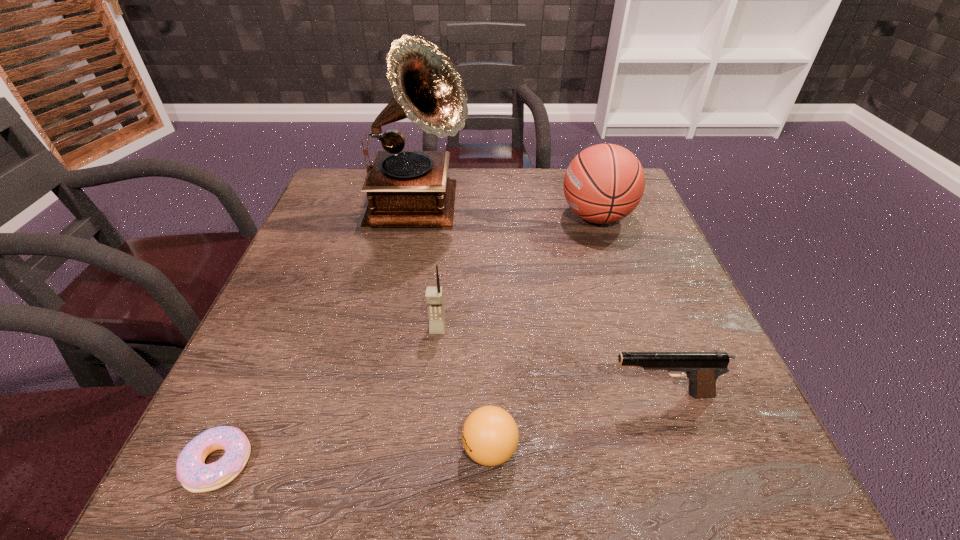
What are the coordinates of `empty space between the pistol and the cellular telephone` in the screenshot? It's located at (549, 362).

Where is `free spot between the doughnut and the basketball`? The height and width of the screenshot is (540, 960). free spot between the doughnut and the basketball is located at coordinates (408, 340).

Locate an element on the screen. empty location between the fourth tallest object and the basketball is located at coordinates (629, 306).

Locate an element on the screen. The width and height of the screenshot is (960, 540). unoccupied area between the record player and the basketball is located at coordinates (508, 213).

Image resolution: width=960 pixels, height=540 pixels. I want to click on vacant space that's between the third farthest object and the doughnut, so click(x=328, y=396).

Locate an element on the screen. This screenshot has height=540, width=960. vacant point located between the cellular telephone and the basketball is located at coordinates (517, 273).

This screenshot has height=540, width=960. I want to click on free point between the second shortest object and the record player, so click(454, 329).

Where is `vacant space that is in between the fourth shortest object and the basketball`? The width and height of the screenshot is (960, 540). vacant space that is in between the fourth shortest object and the basketball is located at coordinates (517, 273).

Locate which object is the third closest to the leftmost object. Please provide its 2D coordinates. Your answer should be formatted as a tuple, i.e. [(x, y)], where the tuple contains the x and y coordinates of a point satisfying the conditions above.

[(404, 188)]

Point out which object is positioned as the fifth nearest to the basketball. Please provide its 2D coordinates. Your answer should be formatted as a tuple, i.e. [(x, y)], where the tuple contains the x and y coordinates of a point satisfying the conditions above.

[(195, 476)]